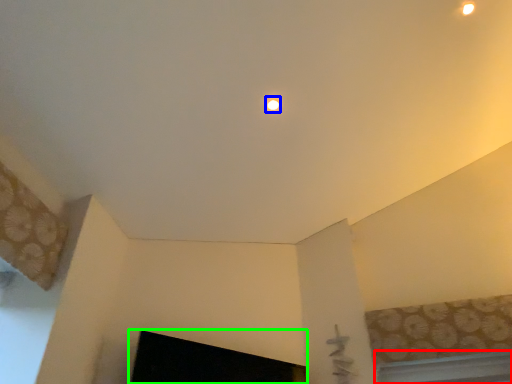
Question: Which object is positioned closest to window (highlighted by a red box)? Select from lighting (highlighted by a blue box) and fireplace (highlighted by a green box).

Choices:
 (A) lighting
 (B) fireplace

Answer: (B)